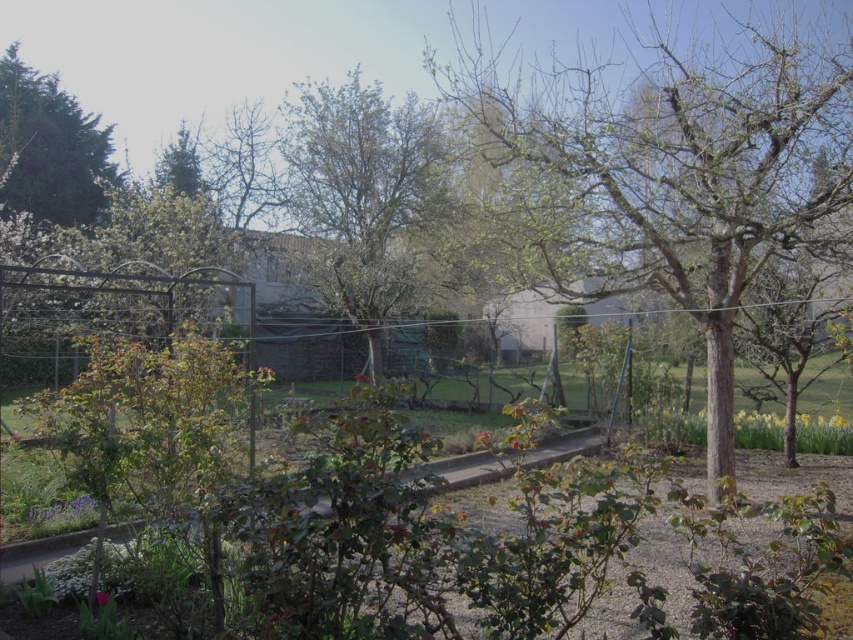
Is metallic wire fence at left positioned behind green leafy tree at upper left?

No, metallic wire fence at left is closer to the viewer.

Who is positioned more to the left, metallic wire fence at left or green leafy tree at upper left?

green leafy tree at upper left is more to the left.

What are the coordinates of `metallic wire fence at left` in the screenshot? It's located at (106, 312).

Between metallic wire fence at left and green matte tree at upper left, which one has more height?

With more height is metallic wire fence at left.

Does metallic wire fence at left appear over green matte tree at upper left?

No.

Which is behind, point (62, 342) or point (187, 193)?

Positioned behind is point (187, 193).

You are a GUI agent. You are given a task and a screenshot of the screen. Output one action in this format:
    pyautogui.click(x=<x>, y=<y>)
    Task: Click on the metallic wire fence at left
    
    Given the screenshot: What is the action you would take?
    pyautogui.click(x=106, y=312)

Between point (352, 273) and point (148, 339), which one is positioned in front?

Point (148, 339) is more forward.

You are a GUI agent. You are given a task and a screenshot of the screen. Output one action in this format:
    pyautogui.click(x=<x>, y=<y>)
    Task: Click on the green leafy tree at center
    The width and height of the screenshot is (853, 640).
    Given the screenshot: What is the action you would take?
    tap(367, 198)

Does point (413, 269) come in front of point (198, 320)?

That is True.

The image size is (853, 640). I want to click on green leafy tree at center, so click(367, 198).